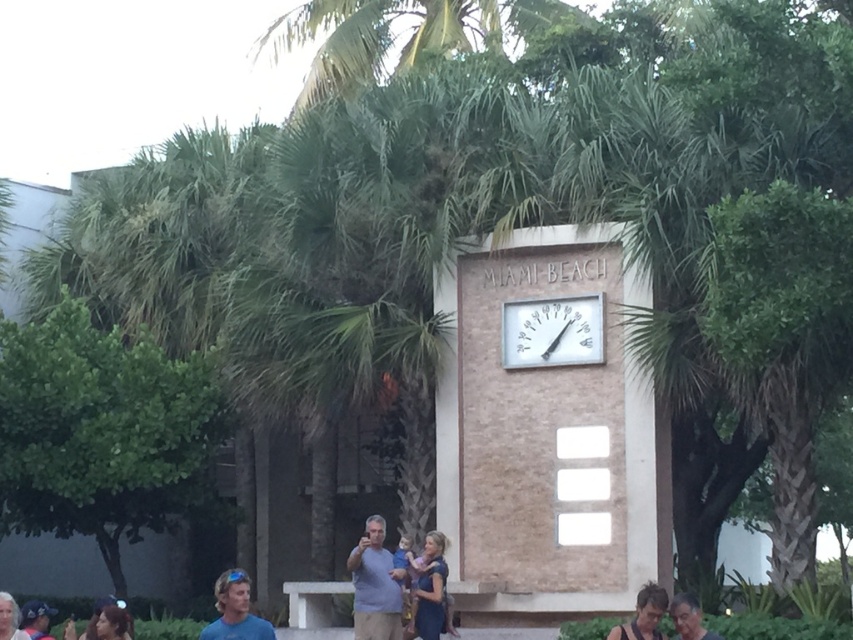
You are a photographer trying to capture a shot of the rectangular structure in Miami Beach. There is a person wearing a blue denim dress at center represented by point (x=430, y=592). Will this person block your view of the rectangular structure? Please answer based on their position.

The blue denim dress at center is represented by point (x=430, y=592), which is at the center of the image. Since the rectangular structure is also in the center, the person wearing the blue denim dress at center is likely blocking the view of the rectangular structure.

You are a photographer at Miami Beach and want to capture both the dark brown hair at lower left and the blonde hair at lower left in a single shot. Which person should you focus on first to ensure both are in frame?

The dark brown hair at lower left is shorter than the blonde hair at lower left. To ensure both are in frame, focus on the taller blonde hair at lower left first, then adjust the camera angle to include the shorter dark brown hair at lower left.